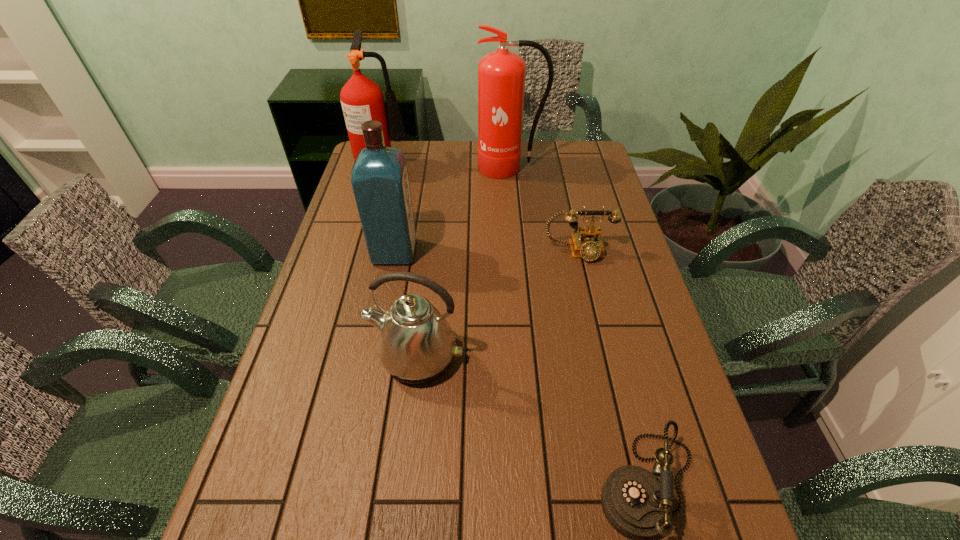
Find the location of a particular element. Image resolution: width=960 pixels, height=540 pixels. free space between the kettle and the right fire extinguisher is located at coordinates (464, 262).

At what (x,y) coordinates should I click in order to perform the action: click on free space between the left fire extinguisher and the farther telephone. Please return your answer as a coordinate pair (x, y). The image size is (960, 540). Looking at the image, I should click on click(x=482, y=208).

Where is `vacant point located between the right fire extinguisher and the farther telephone`? vacant point located between the right fire extinguisher and the farther telephone is located at coordinates (544, 210).

In order to click on empty space that is in between the farther telephone and the left fire extinguisher in this screenshot , I will do `click(482, 208)`.

At what (x,y) coordinates should I click in order to perform the action: click on vacant area that lies between the right fire extinguisher and the fifth farthest object. Please return your answer as a coordinate pair (x, y). The width and height of the screenshot is (960, 540). Looking at the image, I should click on (464, 262).

Identify which object is located as the third nearest to the kettle. Please provide its 2D coordinates. Your answer should be formatted as a tuple, i.e. [(x, y)], where the tuple contains the x and y coordinates of a point satisfying the conditions above.

[(587, 243)]

The height and width of the screenshot is (540, 960). In order to click on the third closest object to the left fire extinguisher in this screenshot , I will do `click(587, 243)`.

The width and height of the screenshot is (960, 540). In order to click on free space that satisfies the following two spatial constraints: 1. at the nozzle of the left fire extinguisher; 2. on the right side of the second nearest object in this screenshot , I will do `click(332, 357)`.

I want to click on free space that satisfies the following two spatial constraints: 1. on the flat label side of the liquor; 2. on the left side of the third shortest object, so click(x=373, y=357).

You are a GUI agent. You are given a task and a screenshot of the screen. Output one action in this format:
    pyautogui.click(x=<x>, y=<y>)
    Task: Click on the vacant space that satisfies the following two spatial constraints: 1. on the dial number of the farther telephone; 2. on the flat label side of the liquor
    The width and height of the screenshot is (960, 540).
    Given the screenshot: What is the action you would take?
    tap(578, 252)